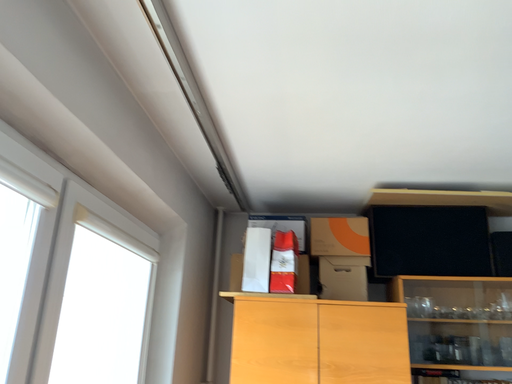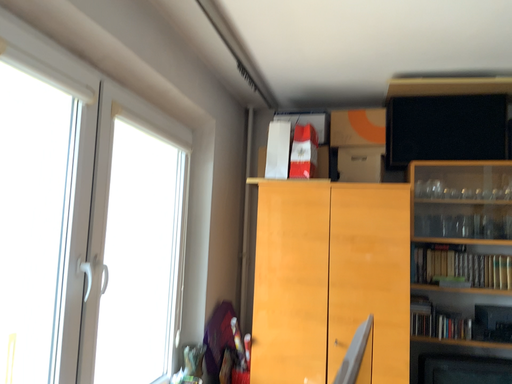
Question: Which way did the camera rotate in the video?

Choices:
 (A) rotated right
 (B) rotated left

Answer: (B)